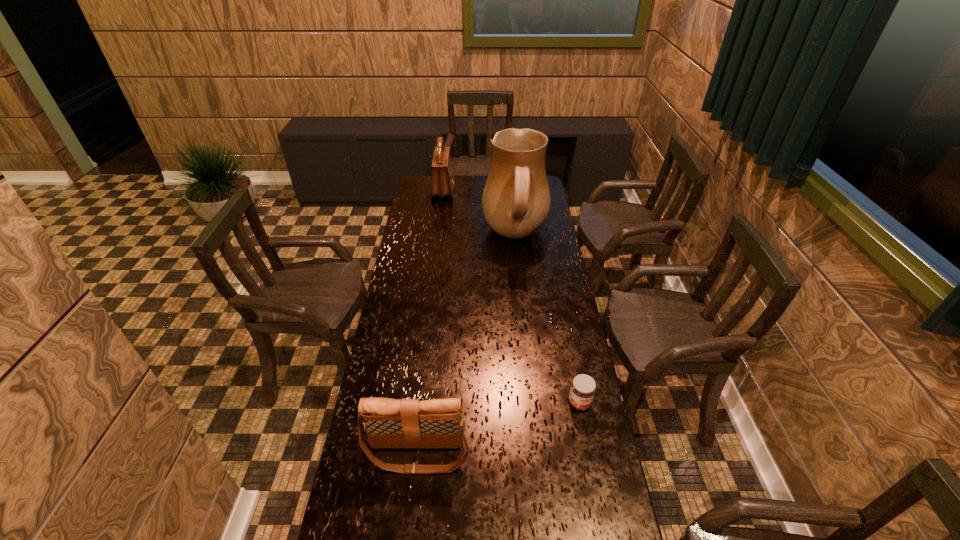
This screenshot has width=960, height=540. Find the location of `vacant space positioned 0.230m at the spout of the tallest object`. vacant space positioned 0.230m at the spout of the tallest object is located at coordinates (436, 236).

This screenshot has height=540, width=960. In order to click on free space located 0.130m on the front flap of the taller shoulder bag in this screenshot , I will do `click(477, 190)`.

Where is `vacant region located 0.130m on the front-facing side of the third tallest object`? The height and width of the screenshot is (540, 960). vacant region located 0.130m on the front-facing side of the third tallest object is located at coordinates (409, 523).

I want to click on blank space located 0.320m on the front of the shortest object, so click(602, 517).

The width and height of the screenshot is (960, 540). I want to click on object located in the far edge section of the desktop, so click(x=442, y=178).

Where is `cream pitcher at the right edge`? cream pitcher at the right edge is located at coordinates (516, 200).

Locate an element on the screen. Image resolution: width=960 pixels, height=540 pixels. jam situated at the right edge is located at coordinates (583, 387).

Locate an element on the screen. Image resolution: width=960 pixels, height=540 pixels. object that is positioned at the far left corner is located at coordinates (442, 178).

Where is `vacant space at the left edge of the desktop`? vacant space at the left edge of the desktop is located at coordinates (363, 535).

Image resolution: width=960 pixels, height=540 pixels. I want to click on free space at the right edge of the desktop, so click(x=542, y=275).